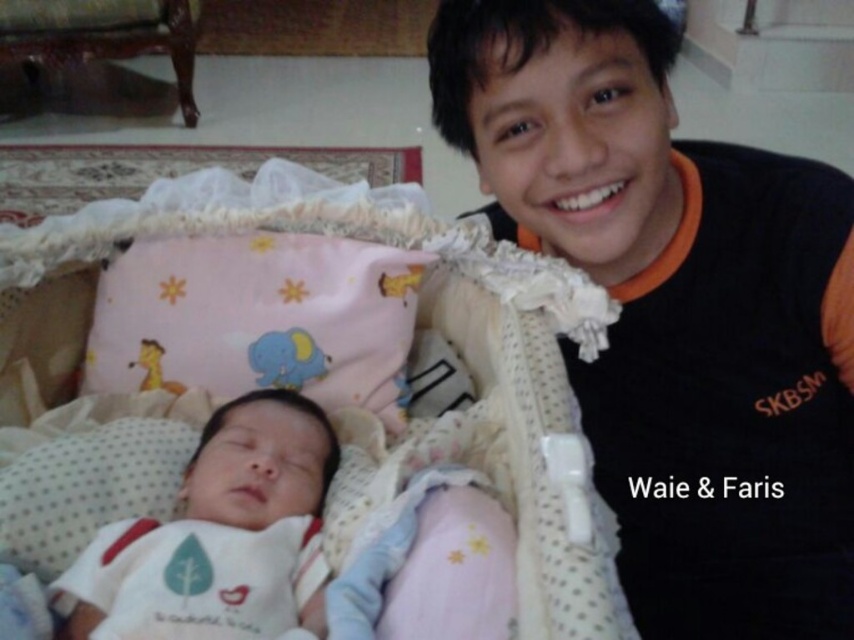
At what (x,y) coordinates should I click in order to perform the action: click on black cotton shirt at upper right. Please return your answer as a coordinate pair (x, y). Looking at the image, I should click on coord(676,310).

Between point (583, 220) and point (531, 627), which one is positioned behind?

The point (583, 220) is behind.

Is point (521, 36) more distant than point (360, 224)?

No, (521, 36) is in front of (360, 224).

This screenshot has width=854, height=640. I want to click on black cotton shirt at upper right, so click(x=676, y=310).

Can you confirm if pink fabric infant bed at center is bigger than white soft fabric at center?

Correct, pink fabric infant bed at center is larger in size than white soft fabric at center.

Does pink fabric infant bed at center appear on the right side of white soft fabric at center?

Indeed, pink fabric infant bed at center is positioned on the right side of white soft fabric at center.

This screenshot has height=640, width=854. Find the location of `pink fabric infant bed at center`. pink fabric infant bed at center is located at coordinates (319, 384).

Locate an element on the screen. Image resolution: width=854 pixels, height=640 pixels. pink fabric infant bed at center is located at coordinates (319, 384).

Between black cotton shirt at upper right and white soft fabric at center, which one has more height?

Standing taller between the two is black cotton shirt at upper right.

Measure the distance from black cotton shirt at upper right to white soft fabric at center.

They are 16.78 inches apart.

Locate an element on the screen. black cotton shirt at upper right is located at coordinates (676, 310).